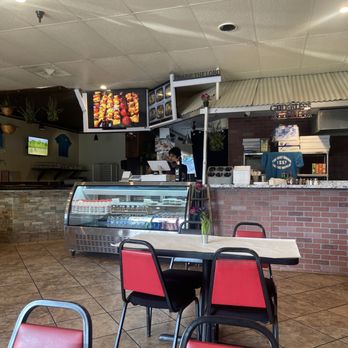
Locate an element on the screen. Image resolution: width=348 pixels, height=348 pixels. cutlery stand is located at coordinates (219, 171).